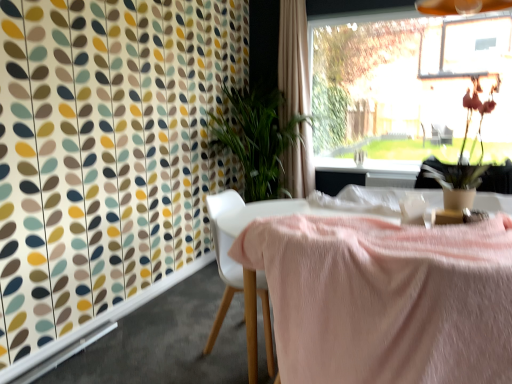
Question: Can you confirm if beige fabric curtain at upper center is thinner than white plastic chair at center?

Choices:
 (A) no
 (B) yes

Answer: (B)

Question: Is beige fabric curtain at upper center turned away from white plastic chair at center?

Choices:
 (A) no
 (B) yes

Answer: (A)

Question: Is beige fabric curtain at upper center shorter than white plastic chair at center?

Choices:
 (A) no
 (B) yes

Answer: (A)

Question: From the image's perspective, is beige fabric curtain at upper center over white plastic chair at center?

Choices:
 (A) no
 (B) yes

Answer: (B)

Question: Is beige fabric curtain at upper center beside white plastic chair at center?

Choices:
 (A) yes
 (B) no

Answer: (B)

Question: From the image's perspective, is transparent glass window at upper right above or below beige fabric curtain at upper center?

Choices:
 (A) below
 (B) above

Answer: (B)

Question: From a real-world perspective, is transparent glass window at upper right physically located above or below beige fabric curtain at upper center?

Choices:
 (A) above
 (B) below

Answer: (A)

Question: In terms of height, does transparent glass window at upper right look taller or shorter compared to beige fabric curtain at upper center?

Choices:
 (A) tall
 (B) short

Answer: (B)

Question: Is point (449, 127) positioned closer to the camera than point (281, 51)?

Choices:
 (A) closer
 (B) farther

Answer: (B)

Question: Based on their sizes in the image, would you say white plastic chair at center is bigger or smaller than transparent glass window at upper right?

Choices:
 (A) small
 (B) big

Answer: (A)

Question: In the image, is white plastic chair at center positioned in front of or behind transparent glass window at upper right?

Choices:
 (A) behind
 (B) front

Answer: (B)

Question: From a real-world perspective, is white plastic chair at center physically located above or below transparent glass window at upper right?

Choices:
 (A) above
 (B) below

Answer: (B)

Question: In terms of width, does white plastic chair at center look wider or thinner when compared to transparent glass window at upper right?

Choices:
 (A) thin
 (B) wide

Answer: (B)

Question: Considering the positions of white plastic chair at center and matte brown vase with dried flowers at upper right in the image, is white plastic chair at center wider or thinner than matte brown vase with dried flowers at upper right?

Choices:
 (A) wide
 (B) thin

Answer: (A)

Question: Relative to matte brown vase with dried flowers at upper right, is white plastic chair at center in front or behind?

Choices:
 (A) front
 (B) behind

Answer: (B)